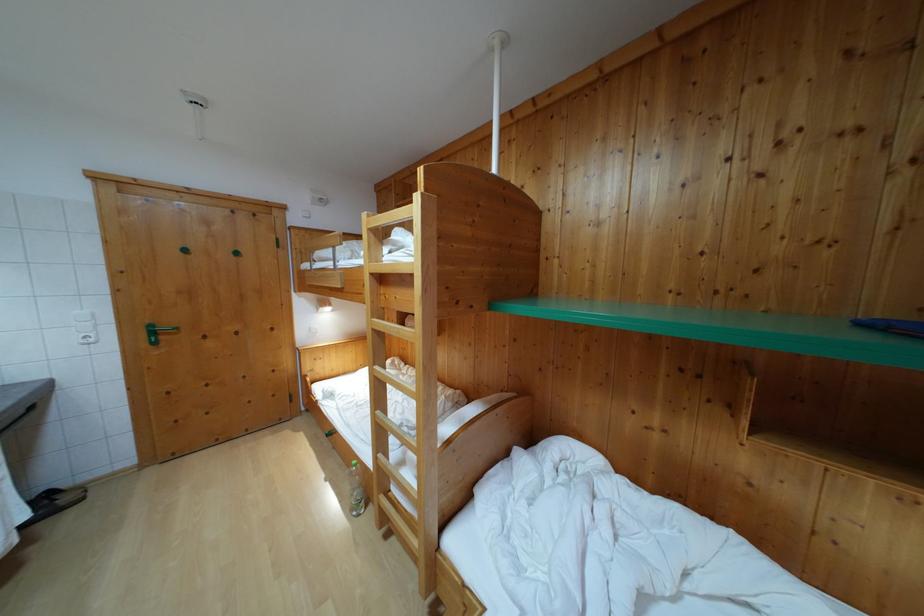
Where is `green door handle`? The image size is (924, 616). green door handle is located at coordinates (161, 329).